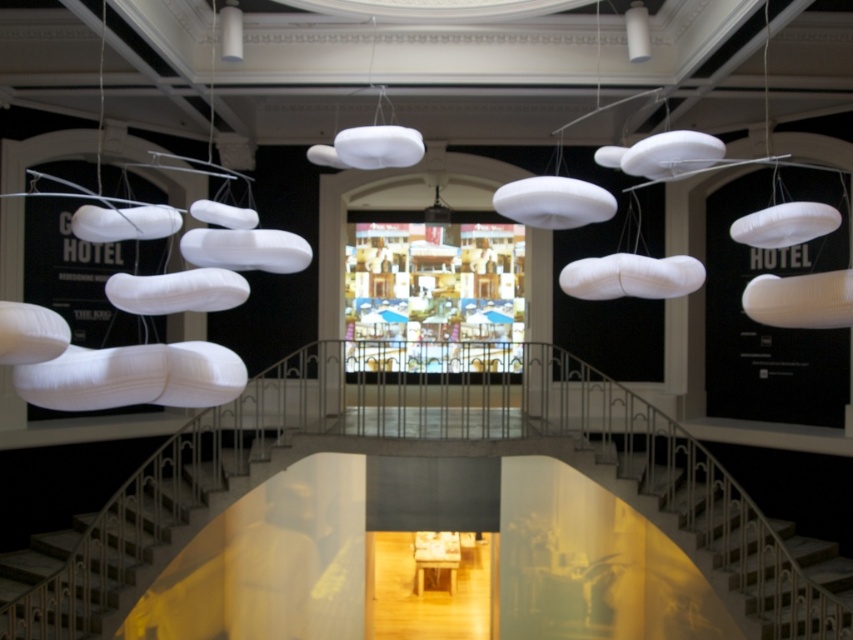
You are an interior designer assessing the space. You need to place a 2m wide decorative panel between the metallic silver stairs at lower center and the metallic silver stairs at center. Can the space accommodate it?

The metallic silver stairs at lower center has a lesser width compared to metallic silver stairs at center. The combined width of both stairs might not leave enough space for a 2m wide panel. However, since the exact distance between them isn answer, it is uncertain. Please check the actual spacing between the two metallic silver stairs.